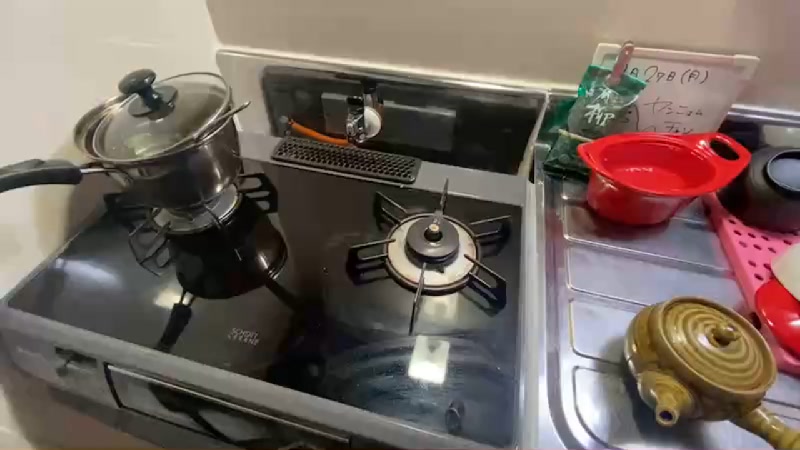
The width and height of the screenshot is (800, 450). What are the coordinates of `black writing on white board` in the screenshot? It's located at point(657,78), point(669,109), point(677,129).